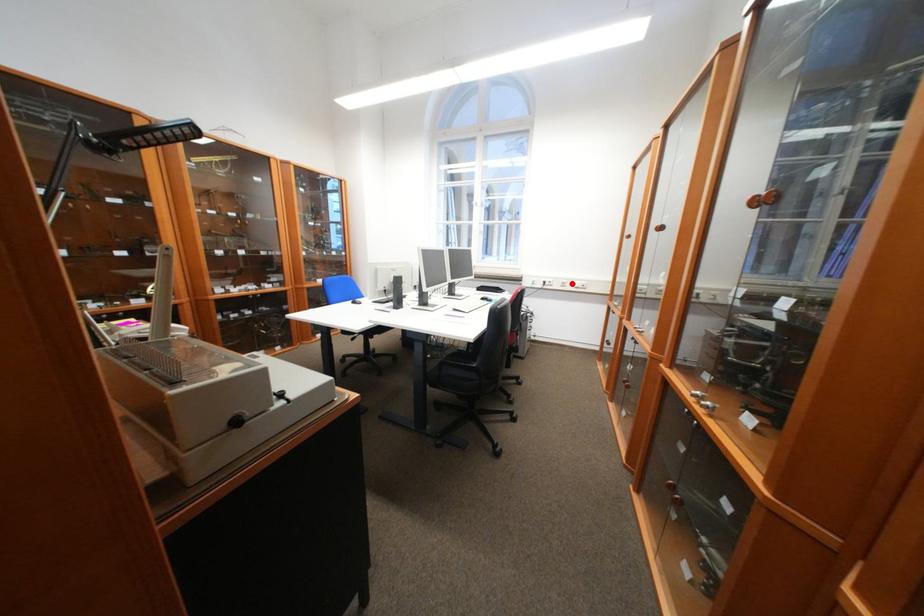
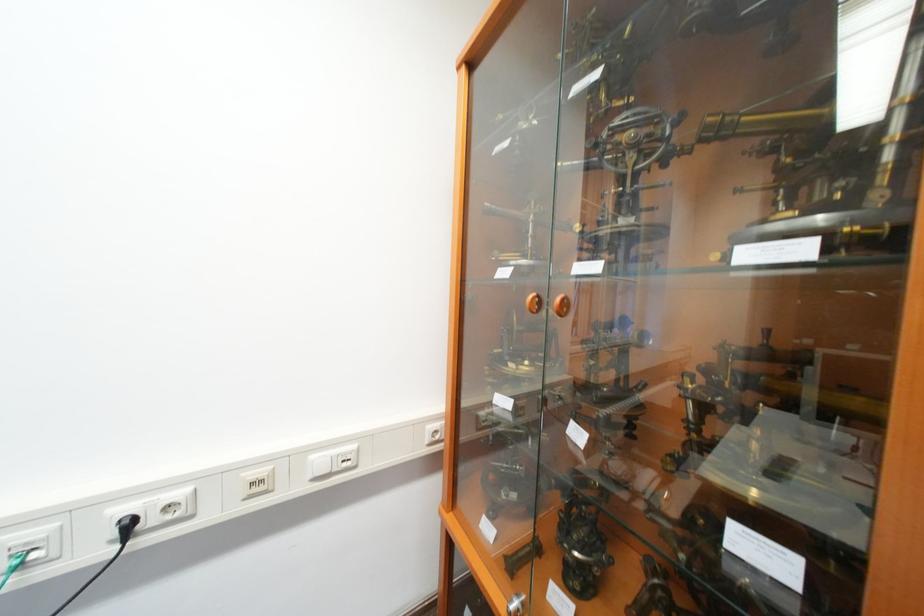
The point at the highlighted location is marked in the first image. Where is the corresponding point in the second image?

(261, 485)